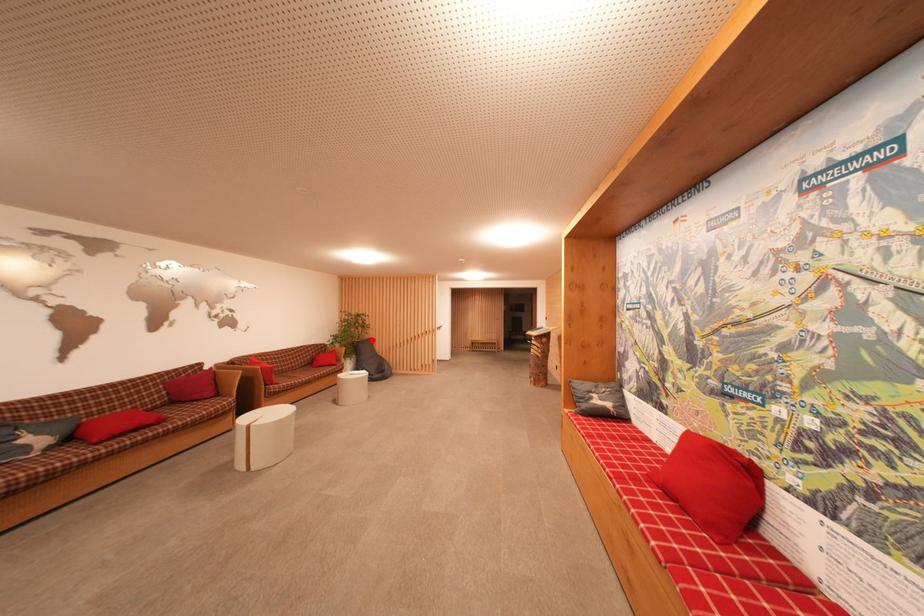
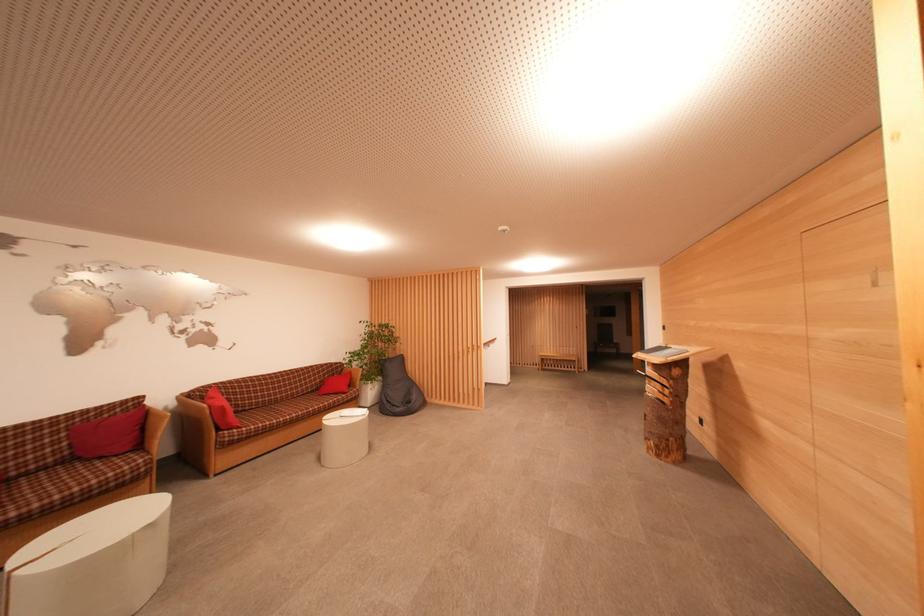
Locate, in the second image, the point that corresponds to the highlighted location in the first image.

(402, 357)